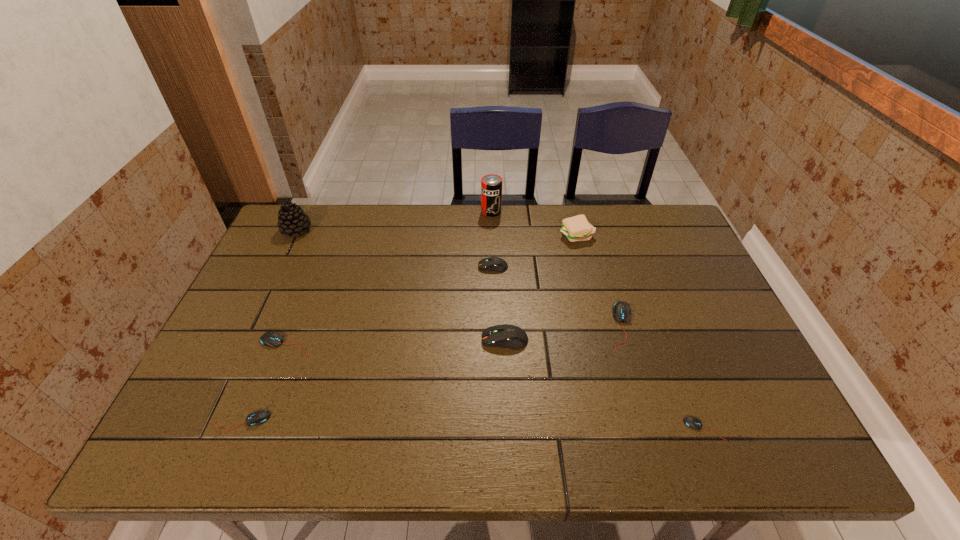
The height and width of the screenshot is (540, 960). I want to click on pinecone located at the far edge, so click(x=292, y=220).

In order to click on patty present at the far edge in this screenshot , I will do `click(577, 228)`.

In order to click on pinecone at the left edge in this screenshot , I will do `click(292, 220)`.

Identify the location of object present at the right edge. (691, 422).

At what (x,y) coordinates should I click in order to perform the action: click on object that is positioned at the far left corner. Please return your answer as a coordinate pair (x, y). Looking at the image, I should click on (292, 220).

The height and width of the screenshot is (540, 960). Find the location of `object that is at the near left corner`. object that is at the near left corner is located at coordinates pos(259,417).

The height and width of the screenshot is (540, 960). Identify the location of object that is at the near right corner. (691, 422).

Locate an element on the screen. This screenshot has width=960, height=540. vacant space at the far edge of the desktop is located at coordinates (535, 237).

This screenshot has height=540, width=960. I want to click on free location at the near edge of the desktop, so click(453, 442).

Identify the location of free space at the left edge of the desktop. The height and width of the screenshot is (540, 960). (292, 256).